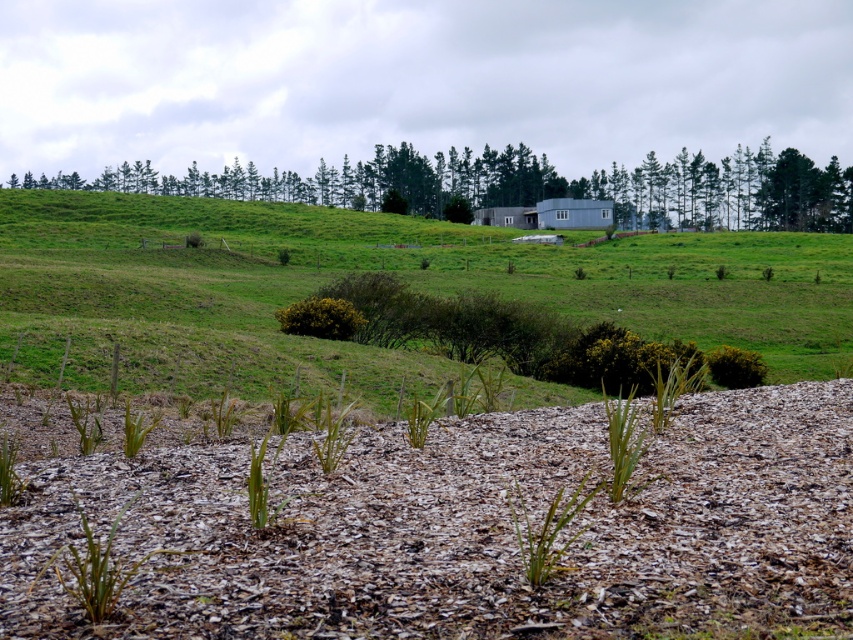
You are standing on the brown mulch at center and want to see the top of the green leafy tree at upper center. Can you see the top without moving your position?

The brown mulch at center has a lesser height compared to green leafy tree at upper center, so yes, you can see the top of the green leafy tree at upper center from your current position on the brown mulch at center since it is taller.

You are a gardener who needs to determine which area is lower to plant a new shrub that prefers shaded, moist soil. Based on the image, which area is lower between the brown mulch at center and the green grassy hillside at upper center?

The brown mulch at center is shorter than the green grassy hillside at upper center, so the brown mulch at center is lower and would be suitable for planting the shrub.